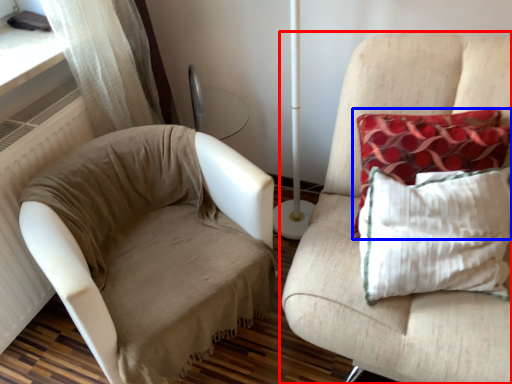
Question: Which point is further to the camera, furniture (highlighted by a red box) or pillow (highlighted by a blue box)?

Choices:
 (A) furniture
 (B) pillow

Answer: (B)